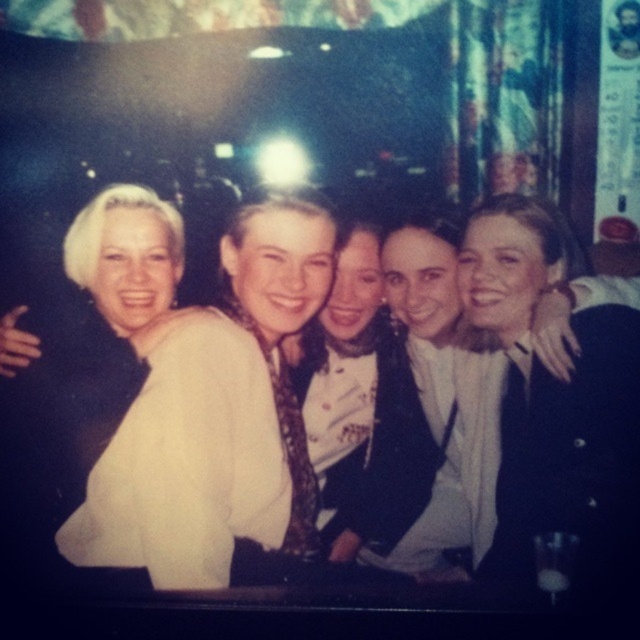
You are at a party and want to take a photo with the white satin blouse at center and the black satin jacket at center. Since you can only focus on one of them, which one should you aim for if you want the one on the left to be in focus?

You should aim for the white satin blouse at center because it is positioned to the left of the black satin jacket at center.

Based on the scene described, which object is positioned more to the left between the white satin blouse at center and the black satin jacket at center?

The white satin blouse at center is positioned more to the left than the black satin jacket at center.

You are standing in the bar and see two points in the image, point (161, 413) and point (65, 419). Which point is nearer to you?

Point (161, 413) is closer to the viewer than point (65, 419).